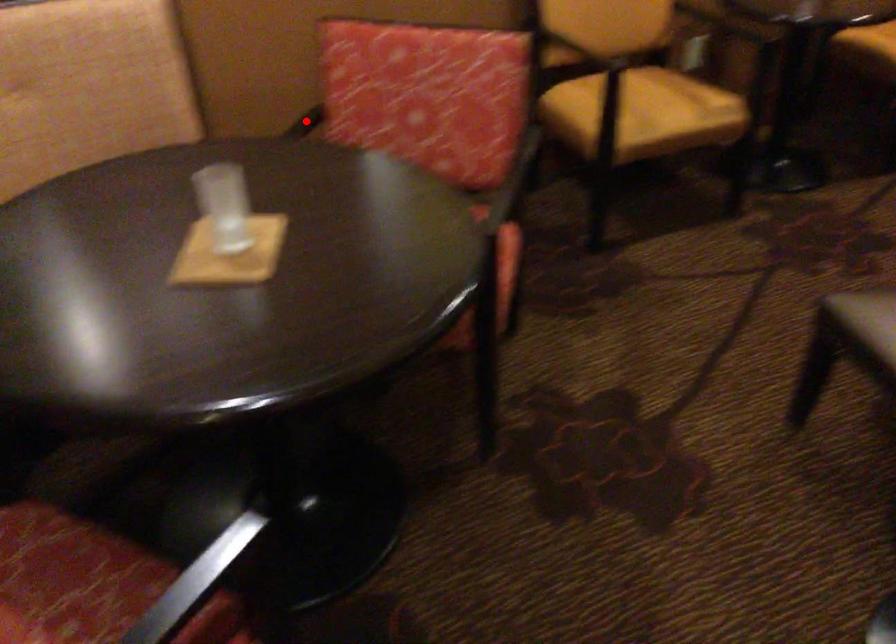
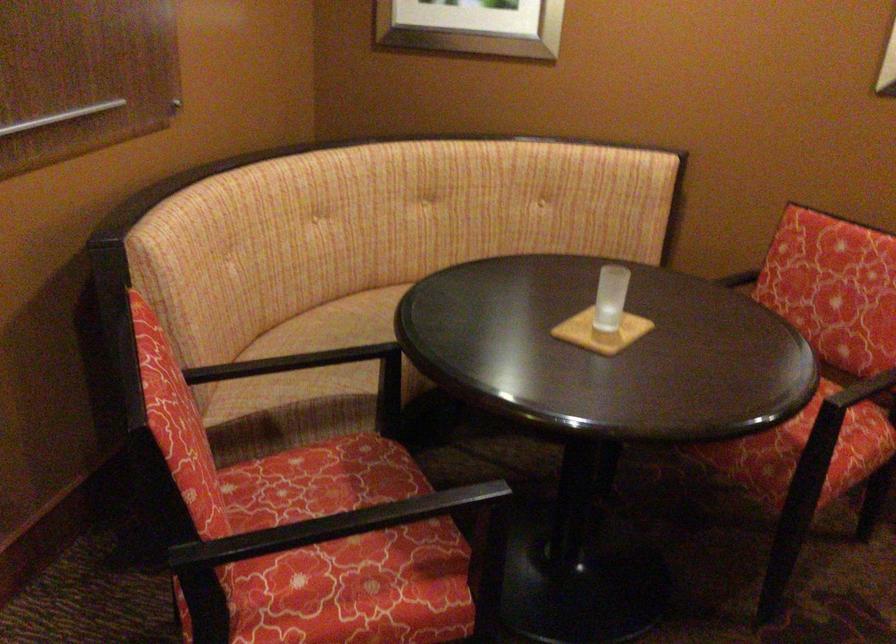
Find the pixel in the second image that matches the highlighted location in the first image.

(738, 279)